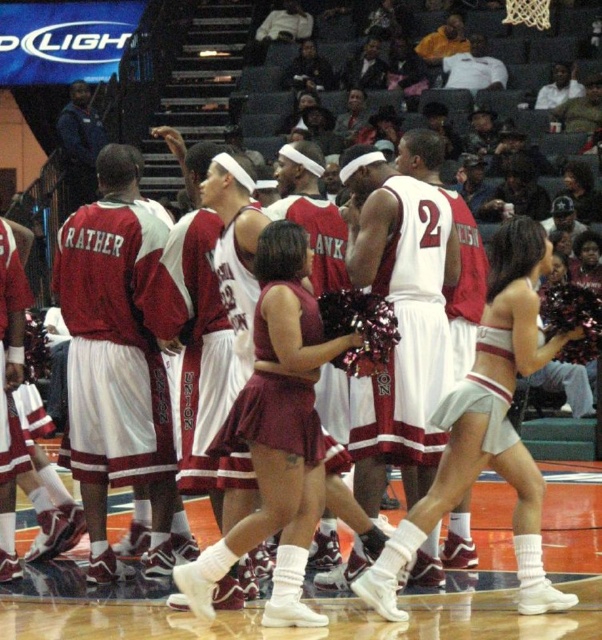
Which of these two, maroon jersey at center or white jersey at center, stands taller?

white jersey at center is taller.

Which is behind, point (122, 330) or point (399, 228)?

Point (122, 330)

You are a GUI agent. You are given a task and a screenshot of the screen. Output one action in this format:
    pyautogui.click(x=<x>, y=<y>)
    Task: Click on the maroon jersey at center
    This screenshot has width=602, height=640.
    Given the screenshot: What is the action you would take?
    pyautogui.click(x=113, y=346)

Where is `maroon jersey at center`? The height and width of the screenshot is (640, 602). maroon jersey at center is located at coordinates [x=113, y=346].